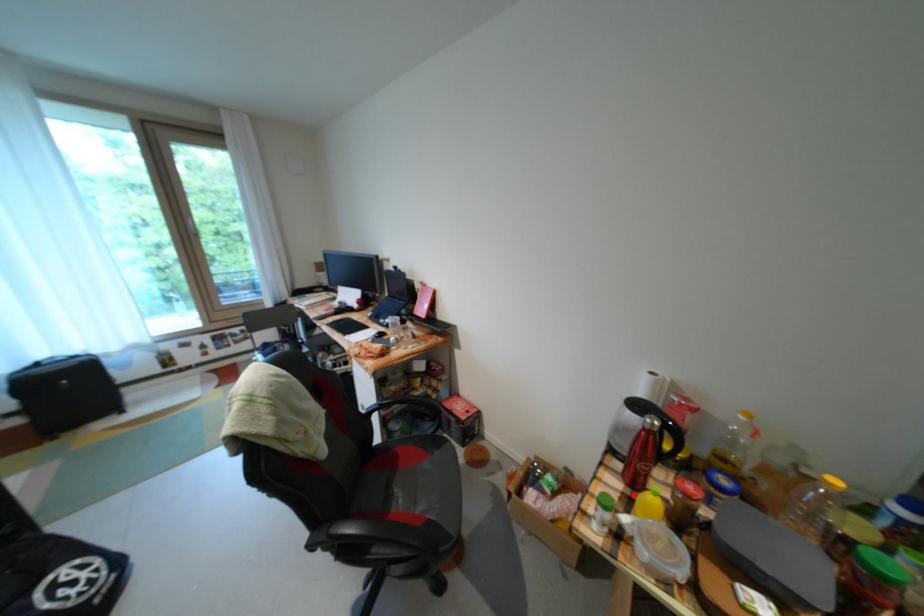
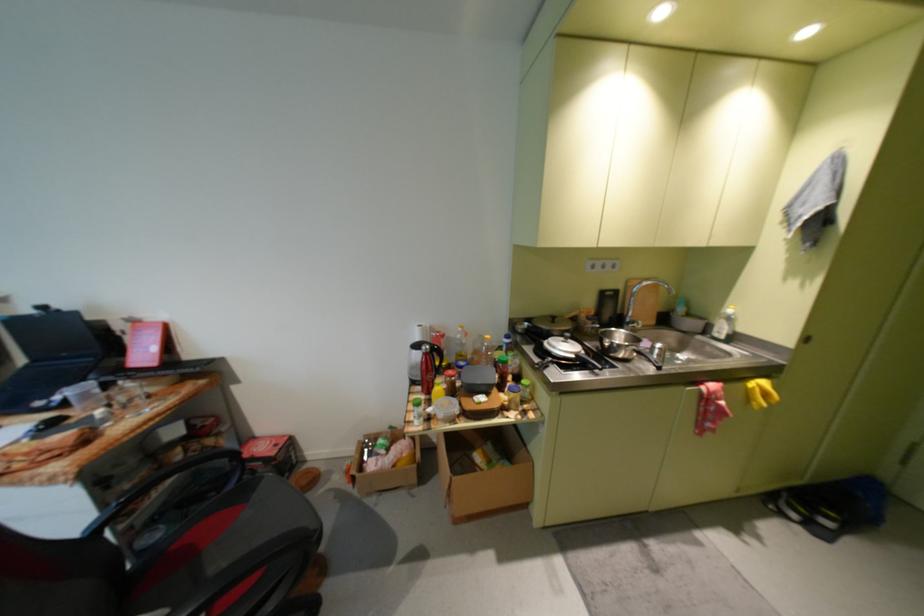
Where in the second image is the point corresponding to the highlighted location from the first image?

(435, 400)